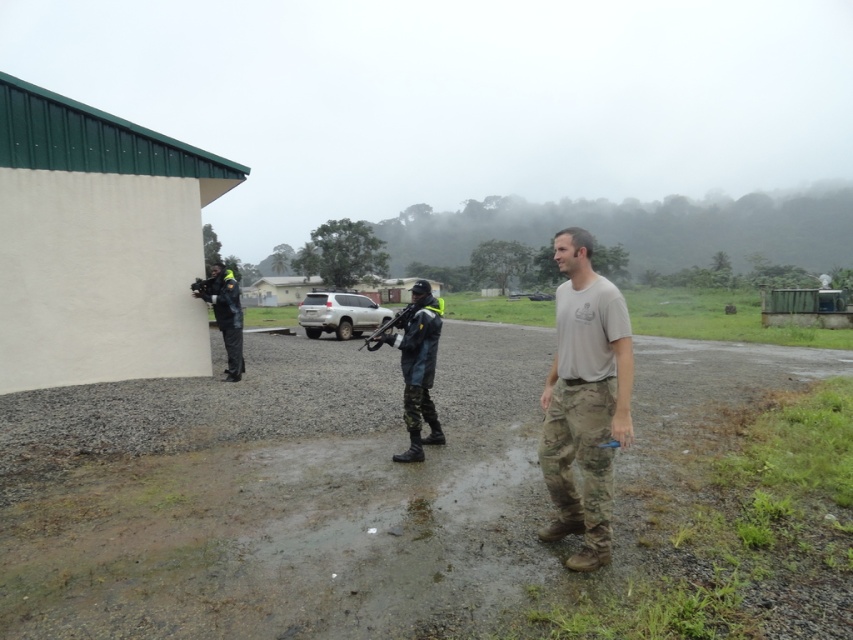
Question: Which of these objects is positioned farthest from the wet gravel mud at center?

Choices:
 (A) matte black rifle at center
 (B) tan/camouflage pants at center
 (C) rubberized black jacket at left

Answer: (B)

Question: Can you confirm if wet gravel mud at center is wider than matte black rifle at center?

Choices:
 (A) no
 (B) yes

Answer: (B)

Question: Estimate the real-world distances between objects in this image. Which object is farther from the matte black rifle at center?

Choices:
 (A) tan/camouflage pants at center
 (B) camouflage fabric uniform at center
 (C) rubberized black jacket at left
 (D) wet gravel mud at center

Answer: (A)

Question: Does tan/camouflage pants at center have a smaller size compared to matte black rifle at center?

Choices:
 (A) yes
 (B) no

Answer: (A)

Question: Can you confirm if tan/camouflage pants at center is positioned below rubberized black jacket at left?

Choices:
 (A) yes
 (B) no

Answer: (A)

Question: Which point is closer to the camera?

Choices:
 (A) (235, 342)
 (B) (403, 317)
 (C) (248, 339)
 (D) (402, 368)

Answer: (D)